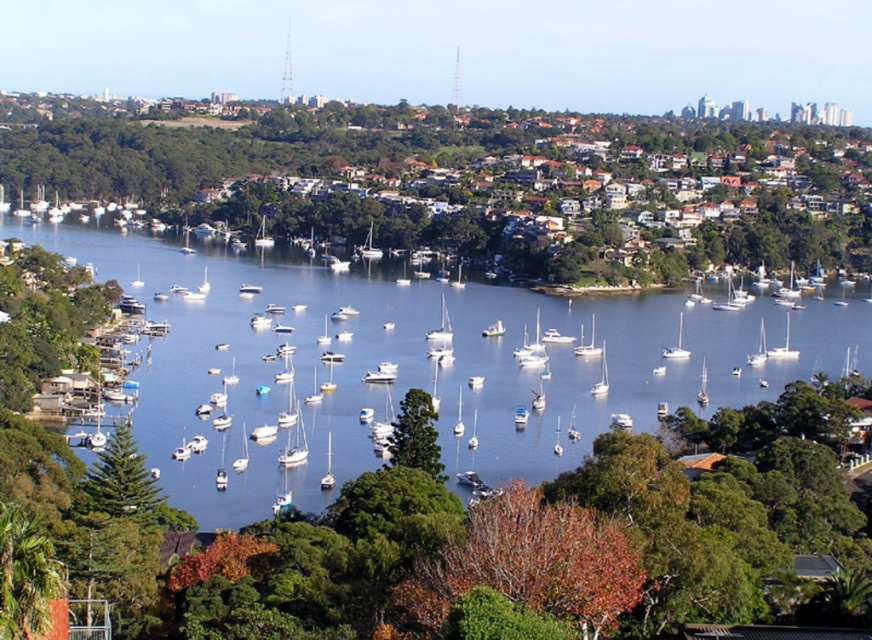
Between point (86, 490) and point (441, 314), which one is positioned in front?

Point (86, 490) is in front.

Who is shorter, green matte tree at lower left or white matte sailboat at center?

green matte tree at lower left is shorter.

Who is more forward, (106, 451) or (433, 332)?

Point (106, 451) is in front.

The image size is (872, 640). What are the coordinates of `green matte tree at lower left` in the screenshot? It's located at (120, 484).

Locate an element on the screen. green leafy tree at center is located at coordinates (479, 180).

Which is more to the right, green leafy tree at center or white glossy sailboat at center?

From the viewer's perspective, white glossy sailboat at center appears more on the right side.

At what (x,y) coordinates should I click in order to perform the action: click on green leafy tree at center. Please return your answer as a coordinate pair (x, y). Looking at the image, I should click on (479, 180).

You are a GUI agent. You are given a task and a screenshot of the screen. Output one action in this format:
    pyautogui.click(x=<x>, y=<y>)
    Task: Click on the green leafy tree at center
    The image size is (872, 640).
    Given the screenshot: What is the action you would take?
    pyautogui.click(x=479, y=180)

Is green leafy tree at center thinner than green matte tree at lower left?

No, green leafy tree at center is not thinner than green matte tree at lower left.

What do you see at coordinates (479, 180) in the screenshot?
I see `green leafy tree at center` at bounding box center [479, 180].

This screenshot has height=640, width=872. I want to click on green leafy tree at center, so click(479, 180).